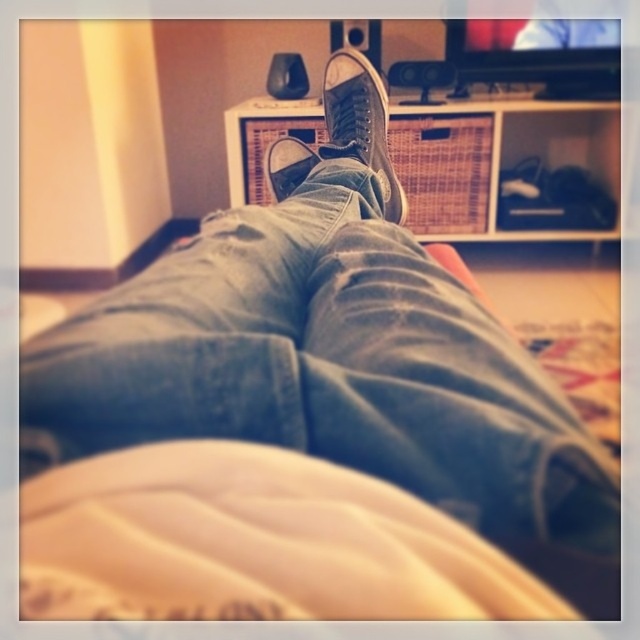
Is woven wood cabinet at upper center smaller than matte black shoe at center?

No.

Is woven wood cabinet at upper center positioned before matte black shoe at center?

No, woven wood cabinet at upper center is behind matte black shoe at center.

Between point (609, 138) and point (308, 157), which one is positioned behind?

Point (609, 138)

At what (x,y) coordinates should I click in order to perform the action: click on woven wood cabinet at upper center. Please return your answer as a coordinate pair (x, y). This screenshot has height=640, width=640. Looking at the image, I should click on (502, 168).

Does point (445, 156) lie in front of point (381, 140)?

No, (445, 156) is behind (381, 140).

Which is below, woven wood cabinet at upper center or matte black sneaker at center?

matte black sneaker at center is below.

Image resolution: width=640 pixels, height=640 pixels. Identify the location of woven wood cabinet at upper center. (502, 168).

Between matte black sneaker at center and matte black shoe at center, which one appears on the right side from the viewer's perspective?

matte black sneaker at center

What do you see at coordinates (358, 122) in the screenshot? I see `matte black sneaker at center` at bounding box center [358, 122].

Find the location of a particular element. matte black sneaker at center is located at coordinates point(358,122).